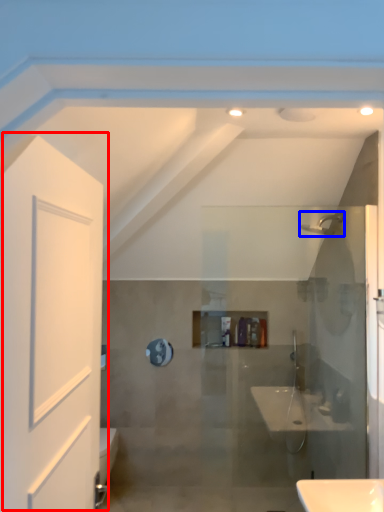
Question: Which of the following is the farthest to the observer, door (highlighted by a red box) or shower (highlighted by a blue box)?

Choices:
 (A) door
 (B) shower

Answer: (B)